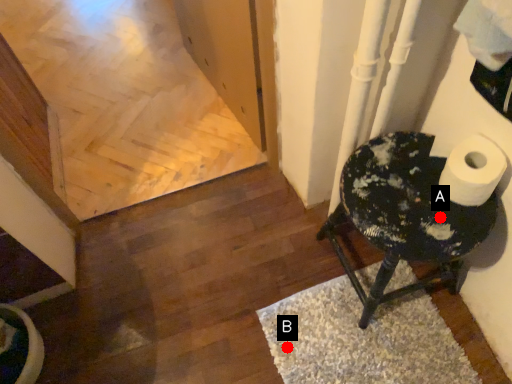
Question: Two points are circled on the image, labeled by A and B beside each circle. Which point is closer to the camera?

Choices:
 (A) A is closer
 (B) B is closer

Answer: (A)